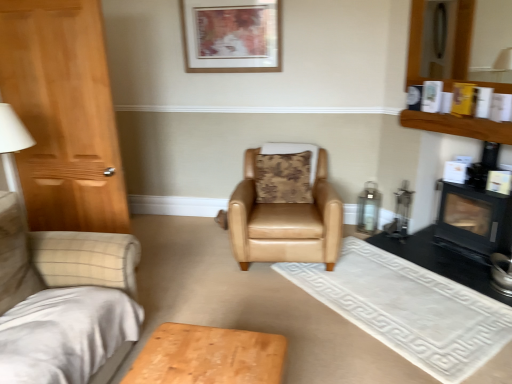
Question: From a real-world perspective, does tan leather armchair at center stand above black matte fireplace at right?

Choices:
 (A) no
 (B) yes

Answer: (A)

Question: Is tan leather armchair at center beside black matte fireplace at right?

Choices:
 (A) yes
 (B) no

Answer: (B)

Question: Is the depth of tan leather armchair at center less than that of black matte fireplace at right?

Choices:
 (A) no
 (B) yes

Answer: (A)

Question: Is tan leather armchair at center bigger than black matte fireplace at right?

Choices:
 (A) yes
 (B) no

Answer: (A)

Question: Is the depth of tan leather armchair at center greater than that of black matte fireplace at right?

Choices:
 (A) yes
 (B) no

Answer: (A)

Question: Is wooden shelf at upper right in front of or behind wooden picture frame at upper center in the image?

Choices:
 (A) front
 (B) behind

Answer: (A)

Question: Considering the positions of point (501, 132) and point (212, 1), is point (501, 132) closer or farther from the camera than point (212, 1)?

Choices:
 (A) farther
 (B) closer

Answer: (B)

Question: Based on their sizes in the image, would you say wooden shelf at upper right is bigger or smaller than wooden picture frame at upper center?

Choices:
 (A) big
 (B) small

Answer: (B)

Question: Considering the relative positions of wooden shelf at upper right and wooden picture frame at upper center in the image provided, is wooden shelf at upper right to the left or to the right of wooden picture frame at upper center?

Choices:
 (A) right
 (B) left

Answer: (A)

Question: In the image, is wooden picture frame at upper center on the left side or the right side of wooden shelf at upper right?

Choices:
 (A) right
 (B) left

Answer: (B)

Question: From the image's perspective, is wooden picture frame at upper center positioned above or below wooden shelf at upper right?

Choices:
 (A) below
 (B) above

Answer: (B)

Question: Do you think wooden picture frame at upper center is within wooden shelf at upper right, or outside of it?

Choices:
 (A) inside
 (B) outside

Answer: (B)

Question: In the image, is wooden picture frame at upper center positioned in front of or behind wooden shelf at upper right?

Choices:
 (A) front
 (B) behind

Answer: (B)

Question: Is point (472, 215) positioned closer to the camera than point (264, 172)?

Choices:
 (A) farther
 (B) closer

Answer: (B)

Question: From a real-world perspective, is black matte fireplace at right physically located above or below camouflage fabric pillow at center?

Choices:
 (A) above
 (B) below

Answer: (B)